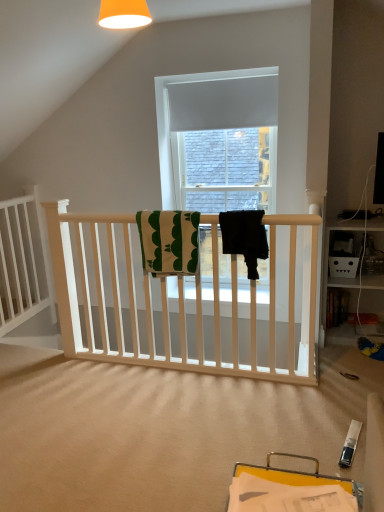
Question: Is there a large distance between black fabric towel at center, the second beach towel in the left-to-right sequence, and green and white textured towel at center, marked as the 1th beach towel in a left-to-right arrangement?

Choices:
 (A) yes
 (B) no

Answer: (B)

Question: Does black fabric towel at center, the second beach towel in the left-to-right sequence, lie behind green and white textured towel at center, marked as the 1th beach towel in a left-to-right arrangement?

Choices:
 (A) no
 (B) yes

Answer: (A)

Question: Does black fabric towel at center, the 1th beach towel from the right, have a greater width compared to green and white textured towel at center, the second beach towel when ordered from right to left?

Choices:
 (A) yes
 (B) no

Answer: (A)

Question: From the image's perspective, is black fabric towel at center, the second beach towel in the left-to-right sequence, on top of green and white textured towel at center, marked as the 1th beach towel in a left-to-right arrangement?

Choices:
 (A) no
 (B) yes

Answer: (B)

Question: Is black fabric towel at center, the 1th beach towel from the right, next to green and white textured towel at center, the second beach towel when ordered from right to left, and touching it?

Choices:
 (A) no
 (B) yes

Answer: (A)

Question: From the image's perspective, relative to black fabric towel at center, the 1th beach towel from the right, is white wooden bed frame at left above or below?

Choices:
 (A) below
 (B) above

Answer: (A)

Question: Is white wooden bed frame at left situated inside black fabric towel at center, the second beach towel in the left-to-right sequence, or outside?

Choices:
 (A) outside
 (B) inside

Answer: (A)

Question: Is white wooden bed frame at left wider or thinner than black fabric towel at center, the second beach towel in the left-to-right sequence?

Choices:
 (A) wide
 (B) thin

Answer: (B)

Question: Is white wooden bed frame at left bigger or smaller than black fabric towel at center, the second beach towel in the left-to-right sequence?

Choices:
 (A) small
 (B) big

Answer: (B)

Question: Is green and white textured towel at center, marked as the 1th beach towel in a left-to-right arrangement, taller or shorter than white wooden bed frame at left?

Choices:
 (A) tall
 (B) short

Answer: (B)

Question: From a real-world perspective, relative to white wooden bed frame at left, is green and white textured towel at center, the second beach towel when ordered from right to left, vertically above or below?

Choices:
 (A) above
 (B) below

Answer: (A)

Question: Does point (142, 236) appear closer or farther from the camera than point (0, 262)?

Choices:
 (A) farther
 (B) closer

Answer: (B)

Question: Visually, is green and white textured towel at center, marked as the 1th beach towel in a left-to-right arrangement, positioned to the left or to the right of white wooden bed frame at left?

Choices:
 (A) right
 (B) left

Answer: (A)

Question: Is black fabric towel at center, the second beach towel in the left-to-right sequence, spatially inside green and white textured towel at center, marked as the 1th beach towel in a left-to-right arrangement, or outside of it?

Choices:
 (A) inside
 (B) outside

Answer: (B)

Question: In terms of width, does black fabric towel at center, the 1th beach towel from the right, look wider or thinner when compared to green and white textured towel at center, the second beach towel when ordered from right to left?

Choices:
 (A) thin
 (B) wide

Answer: (B)